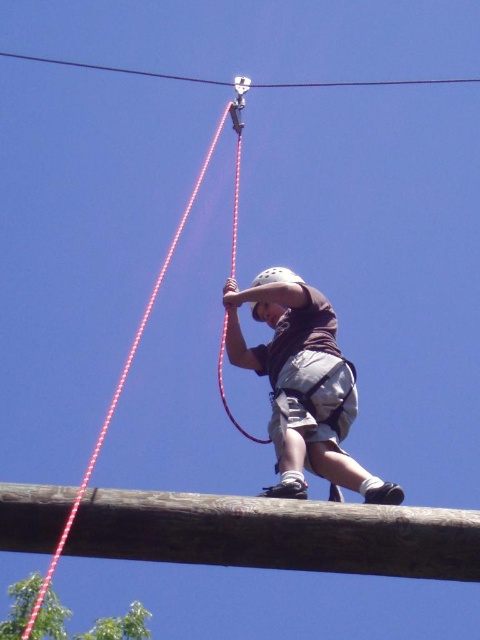
You are a safety inspector checking the setup of an outdoor climbing course. You notice the matte brown shirt at center and the red rope at center. Which object is positioned closer to the observer for ensuring proper harness attachment?

The matte brown shirt at center is closer to the viewer than the red rope at center, so the harness attachment point would be near the red rope at center which is further away.

You are a safety inspector checking the equipment in the image. The matte brown shirt at center and the red rope at center are both critical for safety. Which item has a smaller size?

The matte brown shirt at center has a smaller size compared to the red rope at center.